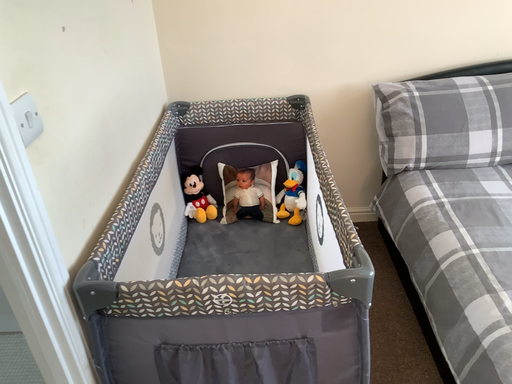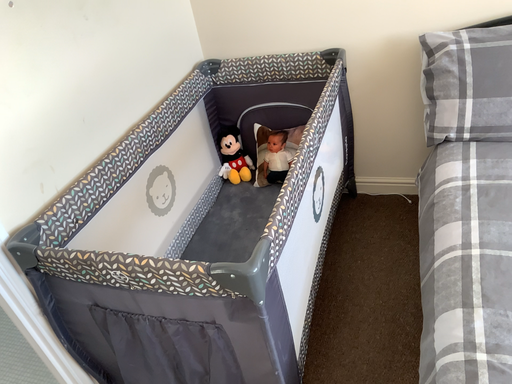
Question: How did the camera likely rotate when shooting the video?

Choices:
 (A) rotated downward
 (B) rotated upward

Answer: (A)